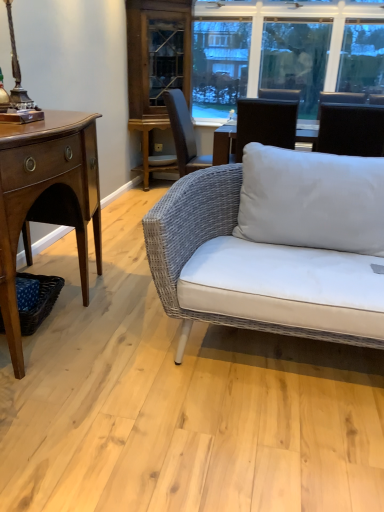
Question: From a real-world perspective, is blue woven picnic basket at lower left beneath black fabric chair at upper right?

Choices:
 (A) yes
 (B) no

Answer: (A)

Question: Is blue woven picnic basket at lower left not within black fabric chair at upper right?

Choices:
 (A) yes
 (B) no

Answer: (A)

Question: Is blue woven picnic basket at lower left looking in the opposite direction of black fabric chair at upper right?

Choices:
 (A) yes
 (B) no

Answer: (B)

Question: Does blue woven picnic basket at lower left have a lesser width compared to black fabric chair at upper right?

Choices:
 (A) yes
 (B) no

Answer: (A)

Question: Can you confirm if blue woven picnic basket at lower left is taller than black fabric chair at upper right?

Choices:
 (A) no
 (B) yes

Answer: (A)

Question: Could you tell me if blue woven picnic basket at lower left is turned towards black fabric chair at upper right?

Choices:
 (A) yes
 (B) no

Answer: (B)

Question: From a real-world perspective, is mahogany wood desk at left on wooden cabinet at center?

Choices:
 (A) yes
 (B) no

Answer: (B)

Question: Can you confirm if mahogany wood desk at left is bigger than wooden cabinet at center?

Choices:
 (A) yes
 (B) no

Answer: (A)

Question: Could you tell me if mahogany wood desk at left is facing wooden cabinet at center?

Choices:
 (A) yes
 (B) no

Answer: (B)

Question: Is mahogany wood desk at left beside wooden cabinet at center?

Choices:
 (A) yes
 (B) no

Answer: (B)

Question: Would you say mahogany wood desk at left contains wooden cabinet at center?

Choices:
 (A) yes
 (B) no

Answer: (B)

Question: Is mahogany wood desk at left wider than wooden cabinet at center?

Choices:
 (A) no
 (B) yes

Answer: (B)

Question: Is clear glass window at upper center bigger than black fabric chair at upper right?

Choices:
 (A) no
 (B) yes

Answer: (B)